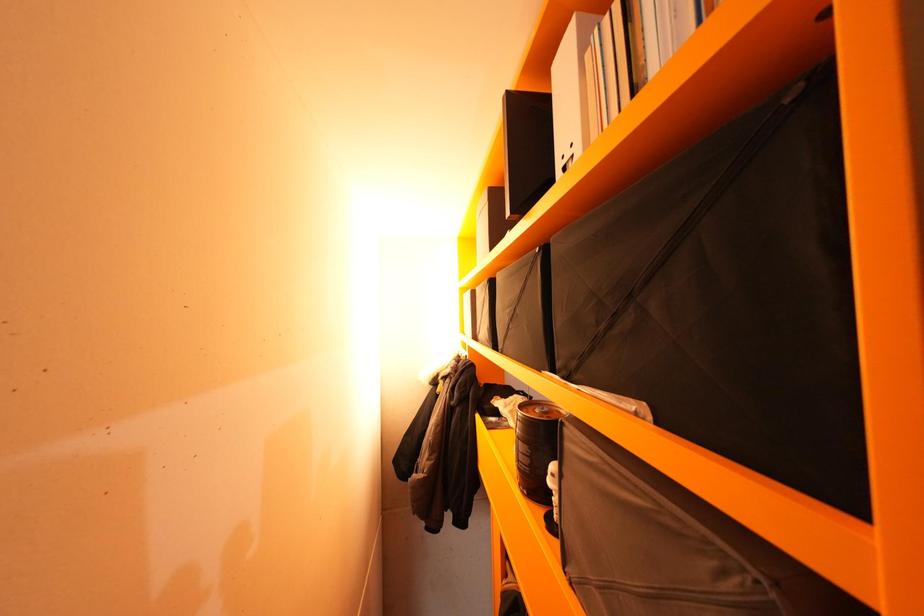
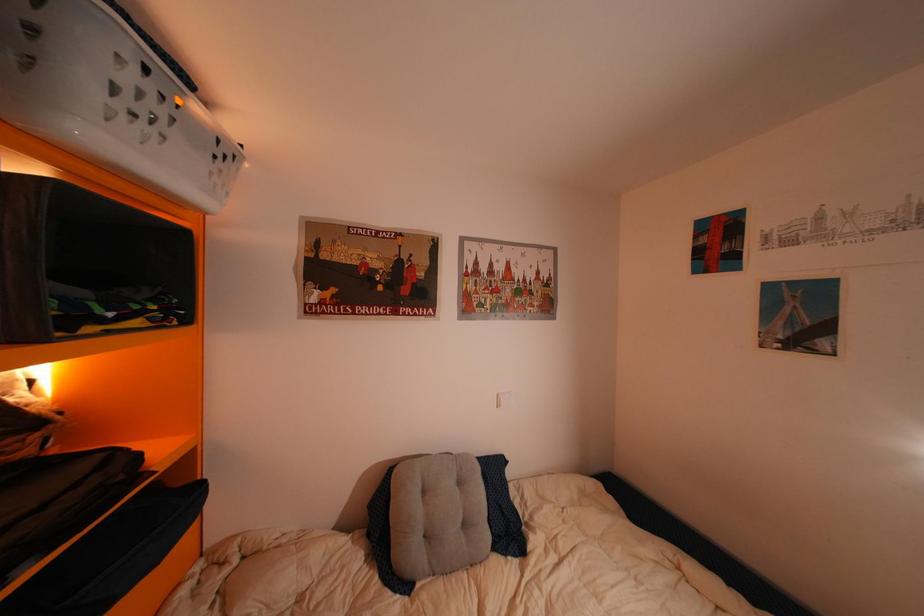
What movement of the cameraman would produce the second image?

The movement direction of the cameraman is right, forward.